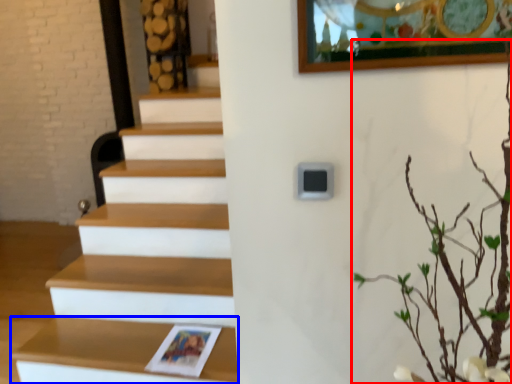
Question: Which of the following is the closest to the observer, tree (highlighted by a red box) or shelf (highlighted by a blue box)?

Choices:
 (A) tree
 (B) shelf

Answer: (A)